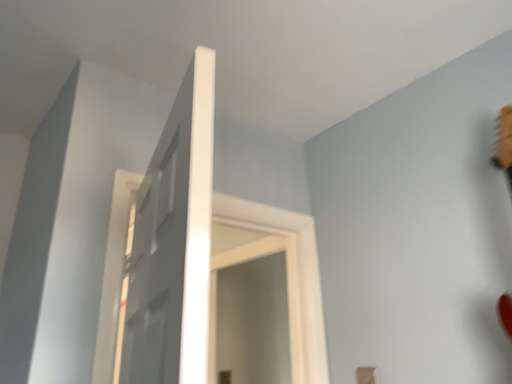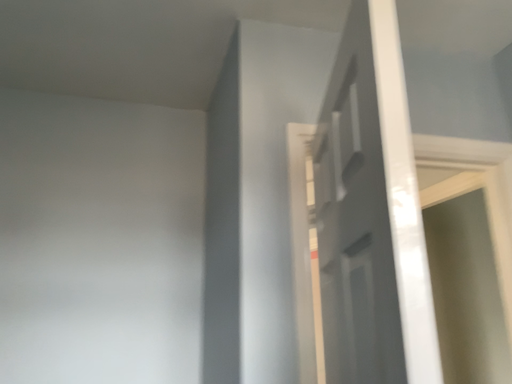
Question: How did the camera likely rotate when shooting the video?

Choices:
 (A) rotated downward
 (B) rotated upward

Answer: (A)